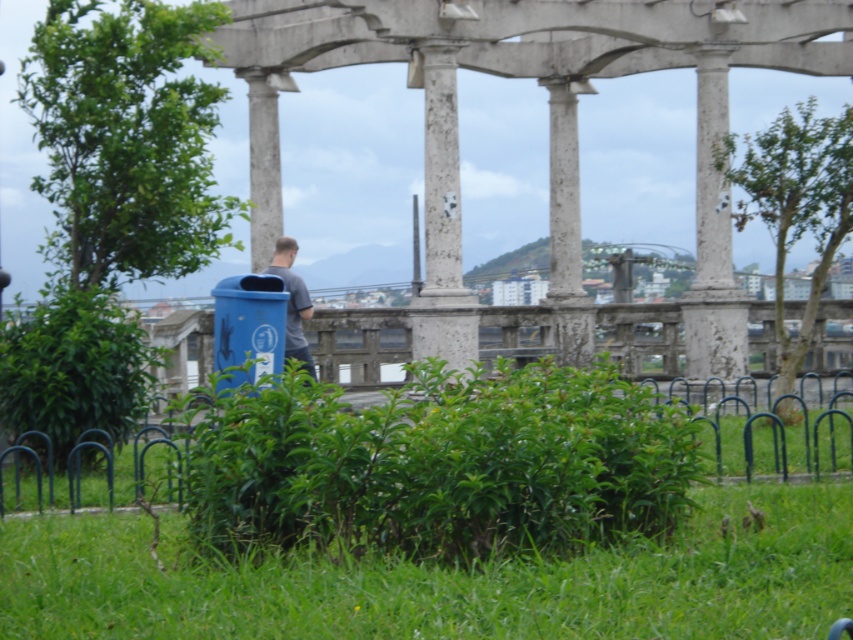
You are standing at the man near the blue recycling bin on the grassy area. You want to walk to the white stone column at center located at point (442, 221). What direction should you walk relative to the man?

The white stone column at center is located at point (442, 221), so you should walk forward from the man near the blue recycling bin to reach it.

Based on the photo, you are standing at the edge of the paved area and want to walk towards the blue recycling bin. Which direction should you move relative to the white stone column at center and the green leafy grass at lower center?

To reach the blue recycling bin, you should move towards the left side of the white stone column at center since the green leafy grass at lower center is positioned on its right side, indicating the recycling bin is likely located in the opposite direction.

You are standing at the blue recycling bin and want to walk to the cityscape in the background. Which point, point (x=424, y=305) or point (x=286, y=248), is closer to your path towards the cityscape?

Point (x=286, y=248) is closer to the path towards the cityscape because it is less further to the viewer compared to point (x=424, y=305).